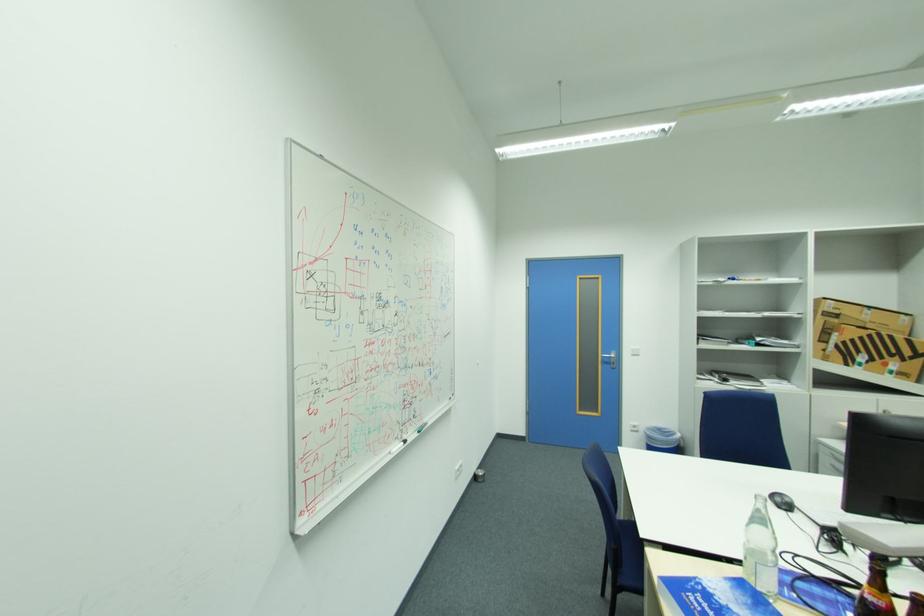
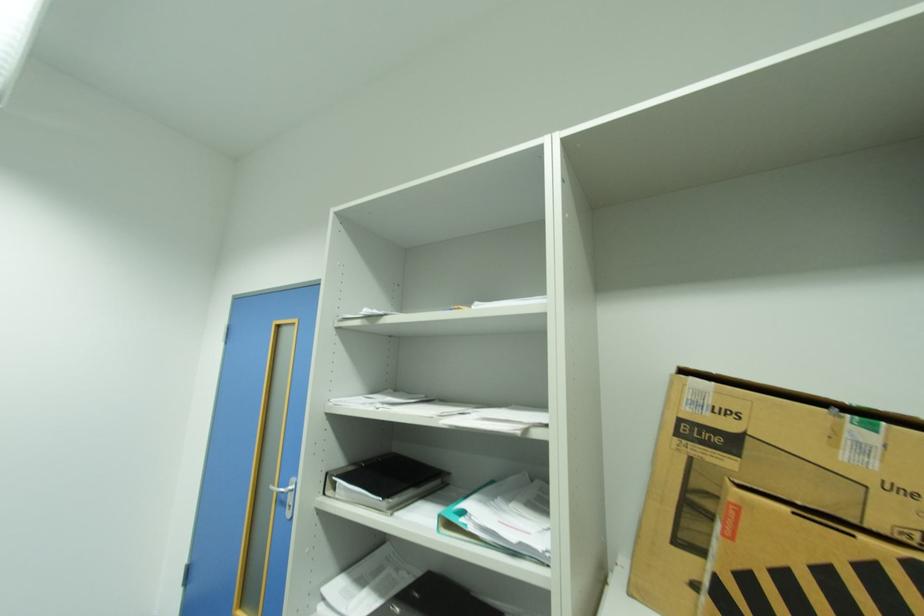
Locate, in the second image, the point that corresponds to (612,362) in the first image.

(287, 498)